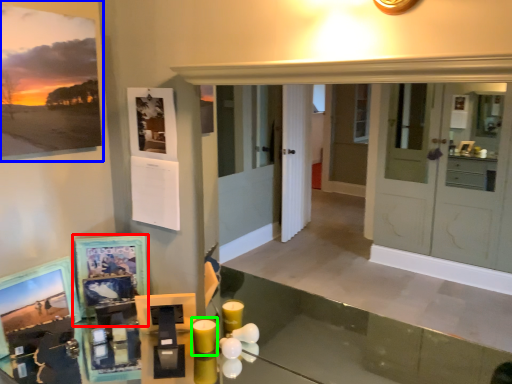
Question: Estimate the real-world distances between objects in this image. Which object is farther from picture frame (highlighted by a red box), picture frame (highlighted by a blue box) or candle (highlighted by a green box)?

Choices:
 (A) picture frame
 (B) candle

Answer: (A)